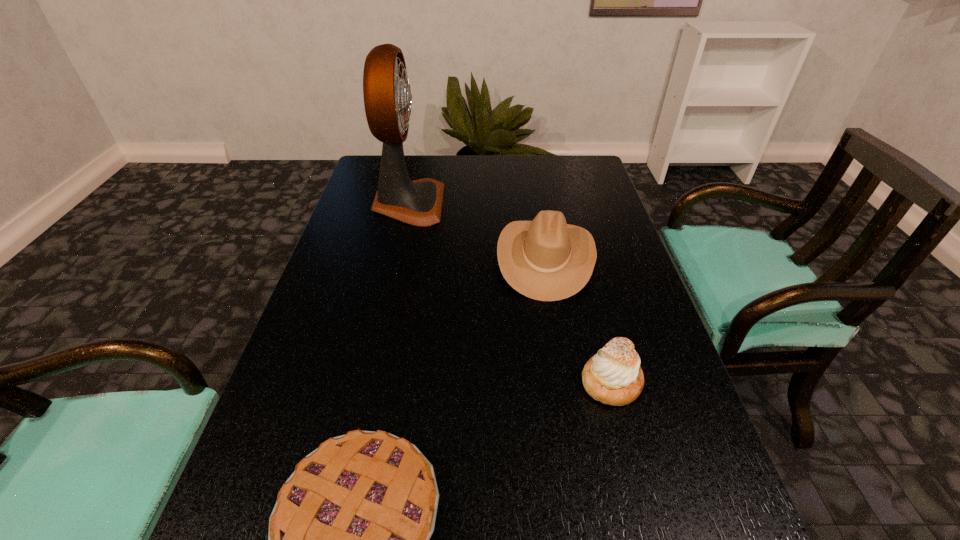
Find the location of a particular element. empty location between the cowboy hat and the tallest object is located at coordinates (477, 231).

Select which object is the third closest to the cowboy hat. Please provide its 2D coordinates. Your answer should be formatted as a tuple, i.e. [(x, y)], where the tuple contains the x and y coordinates of a point satisfying the conditions above.

[(348, 539)]

You are a GUI agent. You are given a task and a screenshot of the screen. Output one action in this format:
    pyautogui.click(x=<x>, y=<y>)
    Task: Click on the object that ranks as the second closest to the fan
    Image resolution: width=960 pixels, height=540 pixels.
    Given the screenshot: What is the action you would take?
    pyautogui.click(x=613, y=376)

This screenshot has height=540, width=960. Find the location of `free space that satisfies the following two spatial constraints: 1. on the front-facing side of the cowboy hat; 2. on the right side of the tallest object`. free space that satisfies the following two spatial constraints: 1. on the front-facing side of the cowboy hat; 2. on the right side of the tallest object is located at coordinates (396, 258).

This screenshot has height=540, width=960. Identify the location of free space that satisfies the following two spatial constraints: 1. on the back side of the cowboy hat; 2. on the front-facing side of the tallest object. (536, 204).

The image size is (960, 540). In order to click on free point that satisfies the following two spatial constraints: 1. on the front-facing side of the fan; 2. on the left side of the second nearest object in this screenshot , I will do `click(369, 382)`.

Find the location of a particular element. free spot that satisfies the following two spatial constraints: 1. on the front-facing side of the tallest object; 2. on the right side of the third farthest object is located at coordinates (369, 382).